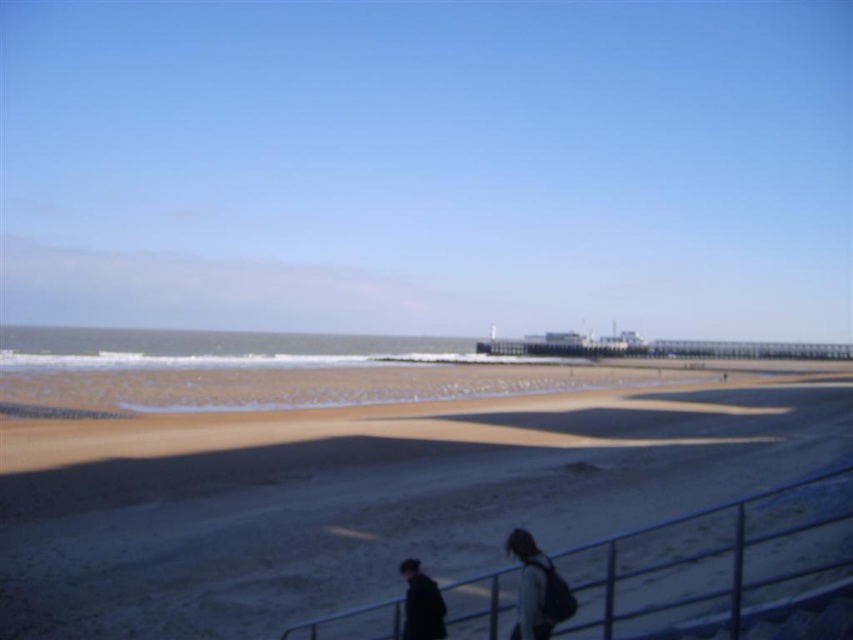
Question: Which point is farther from the camera taking this photo?

Choices:
 (A) (410, 632)
 (B) (700, 419)
 (C) (480, 609)

Answer: (B)

Question: Can you confirm if brown sandy beach at lower center is bigger than metallic silver railing at lower center?

Choices:
 (A) no
 (B) yes

Answer: (B)

Question: Does metallic silver railing at lower center appear on the left side of dark blue fabric jacket at lower center?

Choices:
 (A) no
 (B) yes

Answer: (A)

Question: Does brown sandy beach at lower center have a smaller size compared to dark blue fabric jacket at lower center?

Choices:
 (A) no
 (B) yes

Answer: (A)

Question: Among these objects, which one is farthest from the camera?

Choices:
 (A) dark blue fabric jacket at lower center
 (B) metallic silver railing at lower center
 (C) brown sandy beach at lower center

Answer: (C)

Question: Based on their relative distances, which object is nearer to the dark blue fabric jacket at lower center?

Choices:
 (A) brown sandy beach at lower center
 (B) metallic silver railing at lower center

Answer: (B)